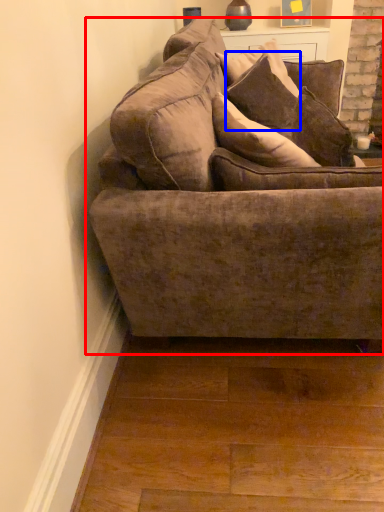
Question: Which object is closer to the camera taking this photo, studio couch (highlighted by a red box) or pillow (highlighted by a blue box)?

Choices:
 (A) studio couch
 (B) pillow

Answer: (A)